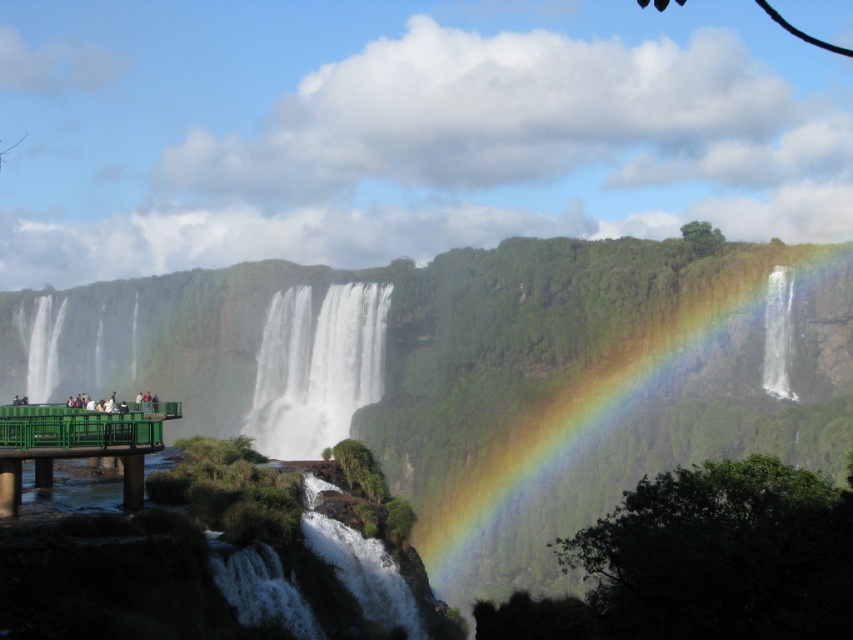
Question: Which of the following is the closest to the observer?

Choices:
 (A) (515, 276)
 (B) (779, 340)
 (C) (108, 417)

Answer: (C)

Question: Can you confirm if rainbow at center is thinner than white smooth waterfall at left?

Choices:
 (A) yes
 (B) no

Answer: (B)

Question: Among these objects, which one is nearest to the camera?

Choices:
 (A) white frothy water at center
 (B) green metallic railing at lower left

Answer: (B)

Question: Does white frothy water at center have a larger size compared to white smooth waterfall at left?

Choices:
 (A) no
 (B) yes

Answer: (B)

Question: Can you confirm if rainbow at center is wider than transparent glass waterfall at right?

Choices:
 (A) no
 (B) yes

Answer: (B)

Question: Which of the following is the farthest from the observer?

Choices:
 (A) (39, 397)
 (B) (782, 268)
 (C) (286, 401)

Answer: (A)